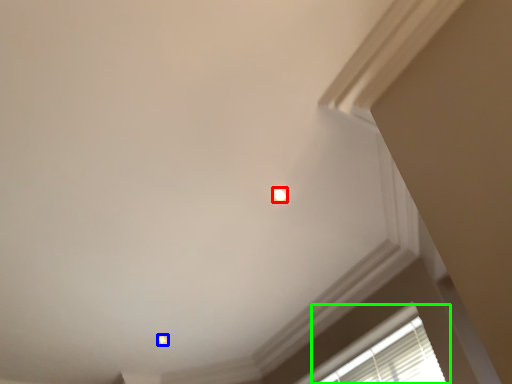
Question: Based on their relative distances, which object is farther from dot (highlighted by a red box)? Choose from dot (highlighted by a blue box) and window (highlighted by a green box).

Choices:
 (A) dot
 (B) window

Answer: (A)